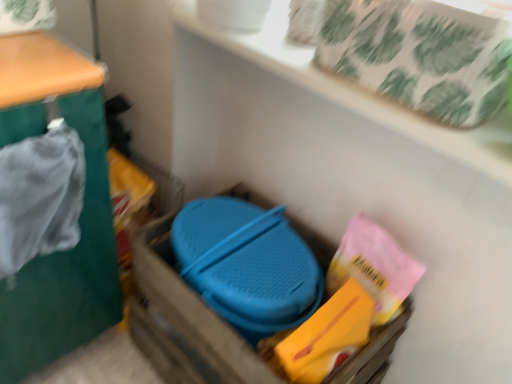
I want to click on green fabric at left, so click(x=79, y=216).

The width and height of the screenshot is (512, 384). I want to click on blue plastic container at center, so click(x=184, y=322).

Identify the location of green fabric at left. (79, 216).

Considering the relative sizes of white textured tray at upper center and green fabric at left in the image provided, is white textured tray at upper center bigger than green fabric at left?

No.

Who is more distant, white textured tray at upper center or green fabric at left?

white textured tray at upper center is further away from the camera.

From the image's perspective, is white textured tray at upper center positioned above or below green fabric at left?

From the image's perspective, white textured tray at upper center appears above green fabric at left.

Would you say green fabric at left is part of white textured tray at upper center's contents?

That's incorrect, green fabric at left is not inside white textured tray at upper center.

From the image's perspective, who appears lower, green fabric at left or white textured tray at upper center?

From the image's view, green fabric at left is below.

Between green fabric at left and white textured tray at upper center, which one appears on the left side from the viewer's perspective?

green fabric at left.

Between green fabric at left and white textured tray at upper center, which one is positioned behind?

Positioned behind is white textured tray at upper center.

Is green fabric at left in front of blue plastic container at center?

Yes, green fabric at left is closer to the viewer.

From the image's perspective, between green fabric at left and blue plastic container at center, which one is located above?

green fabric at left appears higher in the image.

From a real-world perspective, relative to blue plastic container at center, is green fabric at left vertically above or below?

From a real-world perspective, green fabric at left is physically above blue plastic container at center.

Which of these two, green fabric at left or blue plastic container at center, stands taller?

With more height is green fabric at left.

Who is taller, white textured tray at upper center or blue plastic container at center?

With more height is blue plastic container at center.

Is white textured tray at upper center wider or thinner than blue plastic container at center?

white textured tray at upper center is thinner than blue plastic container at center.

Is white textured tray at upper center to the right of blue plastic container at center from the viewer's perspective?

Yes, white textured tray at upper center is to the right of blue plastic container at center.

Can you confirm if blue plastic container at center is smaller than white textured tray at upper center?

Incorrect, blue plastic container at center is not smaller in size than white textured tray at upper center.

Could you tell me if blue plastic container at center is turned towards white textured tray at upper center?

No, blue plastic container at center is not facing towards white textured tray at upper center.

Measure the distance between blue plastic container at center and white textured tray at upper center.

blue plastic container at center and white textured tray at upper center are 22.82 inches apart.

From the image's perspective, would you say blue plastic container at center is shown under white textured tray at upper center?

Yes, from the image's perspective, blue plastic container at center is below white textured tray at upper center.

Looking at this image, is blue plastic container at center smaller than green fabric at left?

Yes.

Is blue plastic container at center taller or shorter than green fabric at left?

Considering their sizes, blue plastic container at center has less height than green fabric at left.

You are a GUI agent. You are given a task and a screenshot of the screen. Output one action in this format:
    pyautogui.click(x=<x>, y=<y>)
    Task: Click on the storage box below the green fabric at left (from the image's perspective)
    The width and height of the screenshot is (512, 384).
    Given the screenshot: What is the action you would take?
    pyautogui.click(x=184, y=322)

Is blue plastic container at center inside the boundaries of green fabric at left, or outside?

blue plastic container at center lies outside green fabric at left.

This screenshot has height=384, width=512. What are the coordinates of `furniture below the white textured tray at upper center (from the image's perspective)` in the screenshot? It's located at (79, 216).

The height and width of the screenshot is (384, 512). I want to click on furniture that appears on the left of white textured tray at upper center, so click(x=79, y=216).

When comparing their distances from green fabric at left, does blue plastic container at center or white textured tray at upper center seem closer?

Among the two, blue plastic container at center is located nearer to green fabric at left.

Looking at the image, which one is located further to blue plastic container at center, green fabric at left or white textured tray at upper center?

Among the two, white textured tray at upper center is located further to blue plastic container at center.

Looking at the image, which one is located further to blue plastic container at center, white textured tray at upper center or green fabric at left?

white textured tray at upper center lies further to blue plastic container at center than the other object.

Based on their spatial positions, is green fabric at left or blue plastic container at center further from white textured tray at upper center?

blue plastic container at center lies further to white textured tray at upper center than the other object.

Which object lies further to the anchor point white textured tray at upper center, blue plastic container at center or green fabric at left?

Based on the image, blue plastic container at center appears to be further to white textured tray at upper center.

Estimate the real-world distances between objects in this image. Which object is further from green fabric at left, white textured tray at upper center or blue plastic container at center?

white textured tray at upper center is further to green fabric at left.

The image size is (512, 384). Identify the location of storage box situated between green fabric at left and white textured tray at upper center from left to right. (184, 322).